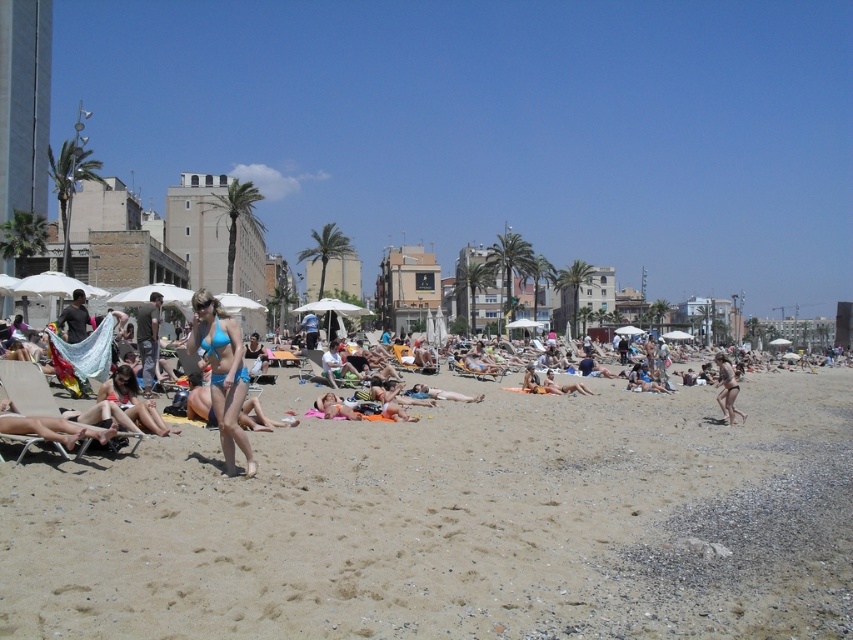
Does blue bikini at center appear over matte blue bikini at right?

Indeed, blue bikini at center is positioned over matte blue bikini at right.

Does blue bikini at center lie in front of matte blue bikini at right?

Yes, blue bikini at center is closer to the viewer.

Who is more forward, (126, 516) or (720, 406)?

Point (126, 516) is in front.

Find the location of `blue bikini at center`. blue bikini at center is located at coordinates (407, 506).

From the picture: Can you confirm if fine-grained sand at center is thinner than blue bikini at center?

Correct, fine-grained sand at center's width is less than blue bikini at center's.

Who is positioned more to the right, fine-grained sand at center or blue bikini at center?

Positioned to the right is blue bikini at center.

What are the coordinates of `fine-grained sand at center` in the screenshot? It's located at (457, 524).

You are a GUI agent. You are given a task and a screenshot of the screen. Output one action in this format:
    pyautogui.click(x=<x>, y=<y>)
    Task: Click on the fine-grained sand at center
    
    Given the screenshot: What is the action you would take?
    pyautogui.click(x=457, y=524)

Can you confirm if fine-grained sand at center is positioned above matte blue bikini at right?

No, fine-grained sand at center is not above matte blue bikini at right.

Consider the image. Is fine-grained sand at center to the left of matte blue bikini at right from the viewer's perspective?

Correct, you'll find fine-grained sand at center to the left of matte blue bikini at right.

You are a GUI agent. You are given a task and a screenshot of the screen. Output one action in this format:
    pyautogui.click(x=<x>, y=<y>)
    Task: Click on the fine-grained sand at center
    Image resolution: width=853 pixels, height=640 pixels.
    Given the screenshot: What is the action you would take?
    pyautogui.click(x=457, y=524)